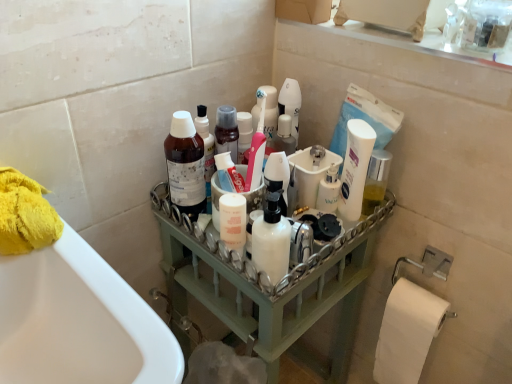
Question: Is point (184, 155) positioned closer to the camera than point (295, 281)?

Choices:
 (A) farther
 (B) closer

Answer: (A)

Question: In terms of width, does translucent plastic bottle at upper center, acting as the first cleaning product starting from the left, look wider or thinner when compared to green wood tray at center?

Choices:
 (A) wide
 (B) thin

Answer: (B)

Question: Estimate the real-world distances between objects in this image. Which object is closer to the green wood tray at center?

Choices:
 (A) white matte pump bottle at center, the second cleaning product when ordered from left to right
 (B) translucent plastic bottle at upper center, the 2th cleaning product from the right
 (C) white glossy mouthwash at center
 (D) white glossy pump bottle at center
 (E) yellow fluffy towel at left

Answer: (B)

Question: Considering the real-world distances, which object is closest to the yellow fluffy towel at left?

Choices:
 (A) green wood tray at center
 (B) white matte pump bottle at center, the second cleaning product when ordered from left to right
 (C) white glossy mouthwash at center
 (D) white glossy pump bottle at center
 (E) translucent plastic bottle at upper center, the first cleaning product positioned from the back

Answer: (E)